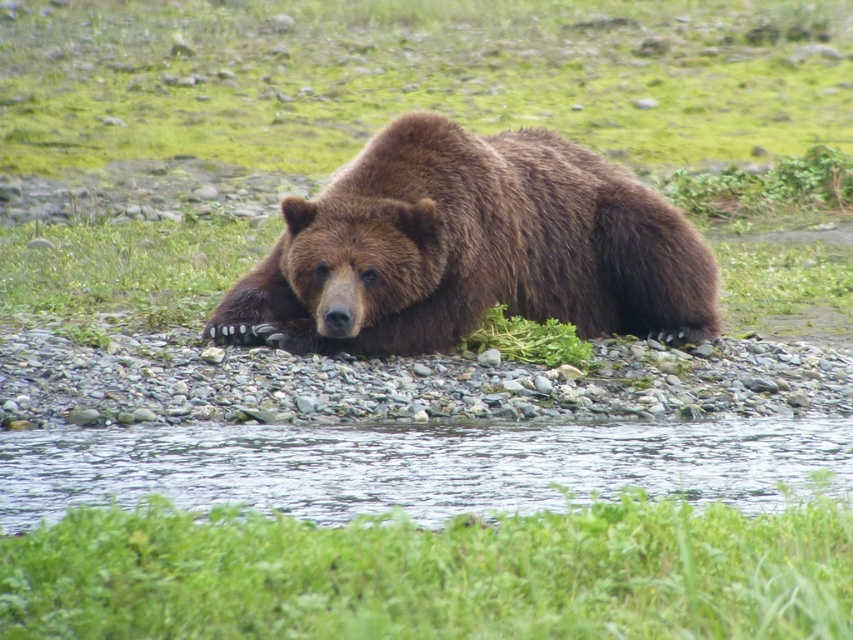
Can you confirm if green leafy grass at lower center is positioned to the left of brown furry bear at center?

No, green leafy grass at lower center is not to the left of brown furry bear at center.

Does green leafy grass at lower center have a smaller size compared to brown furry bear at center?

Yes.

Where is `green leafy grass at lower center`? This screenshot has width=853, height=640. green leafy grass at lower center is located at coordinates pos(434,573).

The height and width of the screenshot is (640, 853). Identify the location of green leafy grass at lower center. (434, 573).

Can you confirm if green leafy grass at lower center is positioned below clear water at center?

No.

Find the location of a particular element. The image size is (853, 640). green leafy grass at lower center is located at coordinates (434, 573).

Locate an element on the screen. The height and width of the screenshot is (640, 853). green leafy grass at lower center is located at coordinates (434, 573).

Measure the distance between brown furry bear at center and clear water at center.

8.87 feet

Is point (335, 240) behind point (167, 445)?

Yes, it is.

Find the location of `brown furry bear at center`. brown furry bear at center is located at coordinates (469, 250).